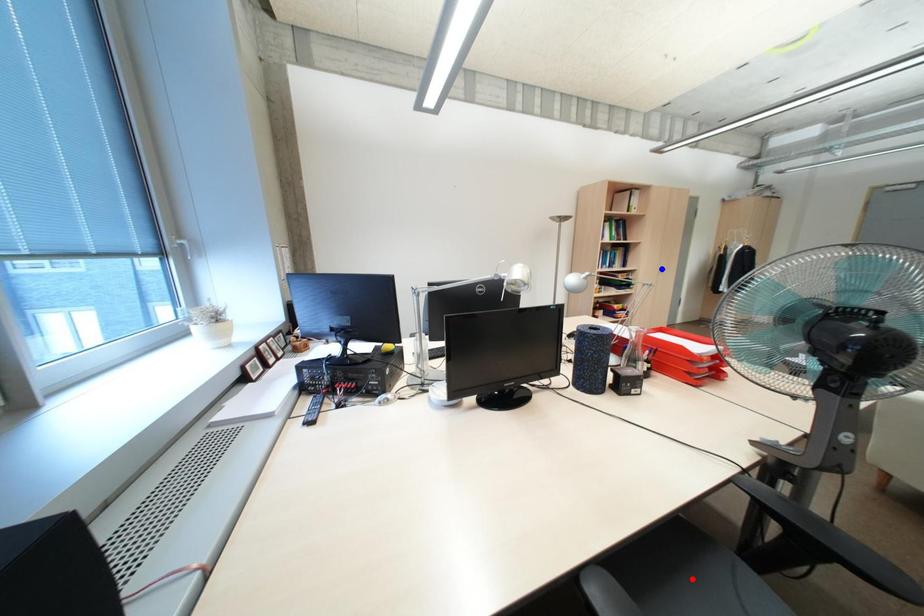
Question: Which of the two points in the image is closer to the camera?

Choices:
 (A) Blue point is closer.
 (B) Red point is closer.

Answer: (B)